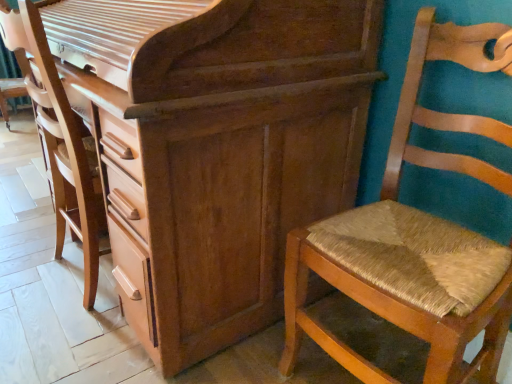
Question: From a real-world perspective, does woven straw chair at right stand above wooden textured swivel chair at center?

Choices:
 (A) yes
 (B) no

Answer: (B)

Question: Is woven straw chair at right closer to camera compared to wooden textured swivel chair at center?

Choices:
 (A) yes
 (B) no

Answer: (A)

Question: Is woven straw chair at right positioned far away from wooden textured swivel chair at center?

Choices:
 (A) yes
 (B) no

Answer: (B)

Question: From the image's perspective, is woven straw chair at right above wooden textured swivel chair at center?

Choices:
 (A) yes
 (B) no

Answer: (B)

Question: From the image's perspective, is woven straw chair at right under wooden textured swivel chair at center?

Choices:
 (A) no
 (B) yes

Answer: (B)

Question: Is wooden textured swivel chair at center wider or thinner than woven straw chair at right?

Choices:
 (A) thin
 (B) wide

Answer: (A)

Question: In the image, is wooden textured swivel chair at center positioned in front of or behind woven straw chair at right?

Choices:
 (A) front
 (B) behind

Answer: (B)

Question: From the image's perspective, is wooden textured swivel chair at center above or below woven straw chair at right?

Choices:
 (A) below
 (B) above

Answer: (B)

Question: From a real-world perspective, is wooden textured swivel chair at center above or below woven straw chair at right?

Choices:
 (A) above
 (B) below

Answer: (A)

Question: From the image's perspective, is woven straw chair at right located above or below wooden textured swivel chair at center?

Choices:
 (A) above
 (B) below

Answer: (B)

Question: Visually, is woven straw chair at right positioned to the left or to the right of wooden textured swivel chair at center?

Choices:
 (A) left
 (B) right

Answer: (B)

Question: Is woven straw chair at right situated inside wooden textured swivel chair at center or outside?

Choices:
 (A) outside
 (B) inside

Answer: (A)

Question: Considering the positions of woven straw chair at right and wooden textured swivel chair at center in the image, is woven straw chair at right wider or thinner than wooden textured swivel chair at center?

Choices:
 (A) wide
 (B) thin

Answer: (A)

Question: Visually, is woven straw chair at right positioned to the left or to the right of wooden chest of drawers at center?

Choices:
 (A) left
 (B) right

Answer: (B)

Question: In the image, is woven straw chair at right positioned in front of or behind wooden chest of drawers at center?

Choices:
 (A) behind
 (B) front

Answer: (B)